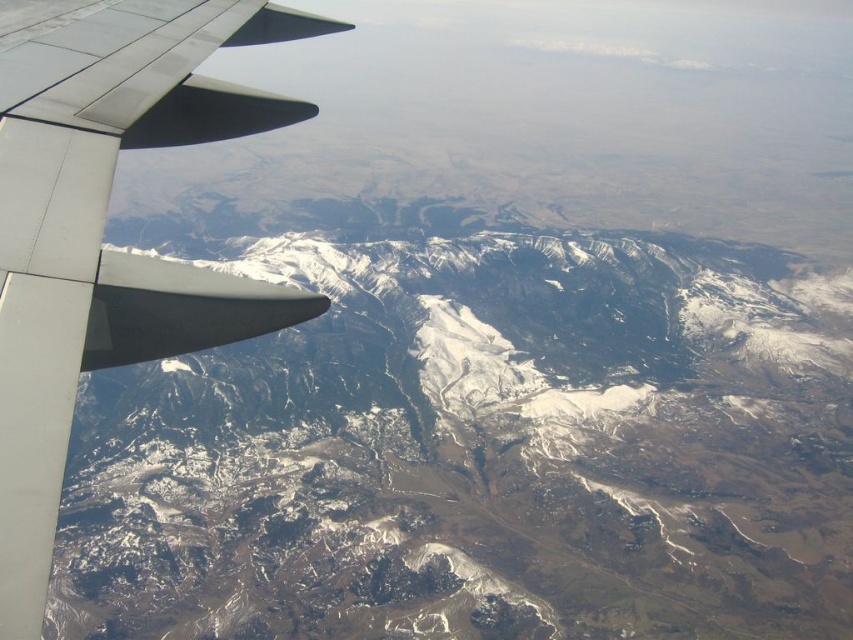
You are a passenger on the plane and looking out the window. You see the snowy rocky mountain range at upper left and the metallic gray wing at left. Which object is closer to you?

The snowy rocky mountain range at upper left is closer to you than the metallic gray wing at left because it is positioned further to the viewer.